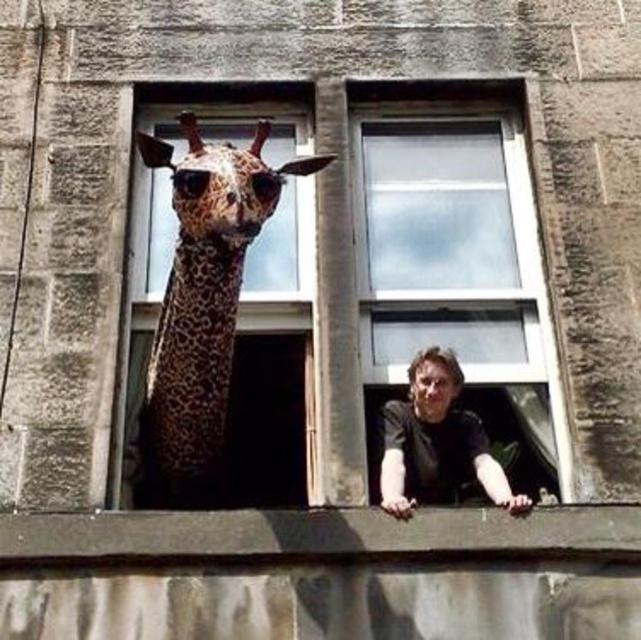
Question: Among these objects, which one is farthest from the camera?

Choices:
 (A) smooth brown hair at center
 (B) spotted brown spotted giraffe at left
 (C) clear glass window at center

Answer: (A)

Question: Which of the following is the closest to the observer?

Choices:
 (A) spotted brown spotted giraffe at left
 (B) smooth brown hair at center
 (C) clear glass window at center
 (D) dark brown leather jacket at center

Answer: (C)

Question: Is clear glass window at center closer to camera compared to spotted brown spotted giraffe at left?

Choices:
 (A) yes
 (B) no

Answer: (A)

Question: Which point is farther from the camera taking this photo?

Choices:
 (A) (537, 232)
 (B) (462, 378)
 (C) (458, 445)

Answer: (A)

Question: Is the position of dark brown leather jacket at center less distant than that of smooth brown hair at center?

Choices:
 (A) no
 (B) yes

Answer: (B)

Question: Does clear glass window at center come in front of smooth brown hair at center?

Choices:
 (A) yes
 (B) no

Answer: (A)